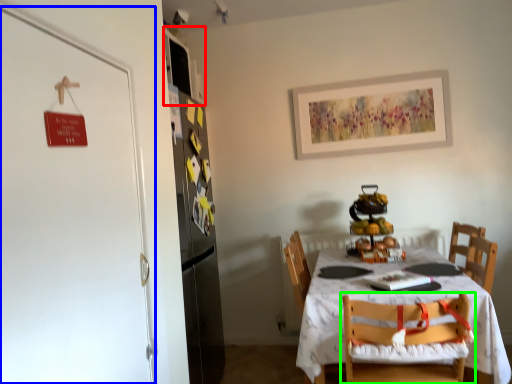
Question: Considering the real-world distances, which object is closest to cabinetry (highlighted by a red box)? door (highlighted by a blue box) or chair (highlighted by a green box).

Choices:
 (A) door
 (B) chair

Answer: (A)